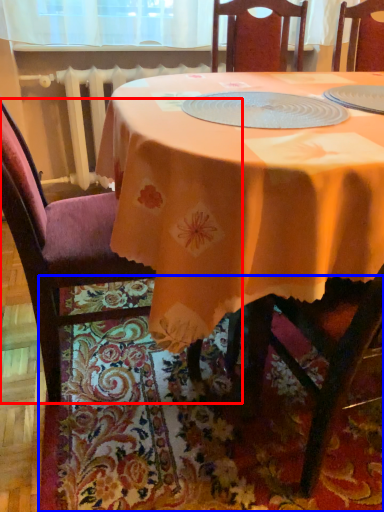
Question: Which object is further to the camera taking this photo, chair (highlighted by a red box) or place mat (highlighted by a blue box)?

Choices:
 (A) chair
 (B) place mat

Answer: (B)